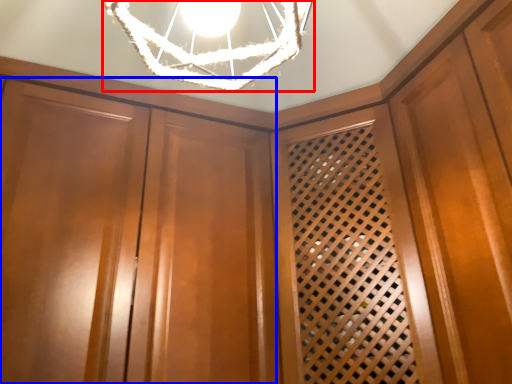
Question: Among these objects, which one is nearest to the camera, lamp (highlighted by a red box) or cabinetry (highlighted by a blue box)?

Choices:
 (A) lamp
 (B) cabinetry

Answer: (A)